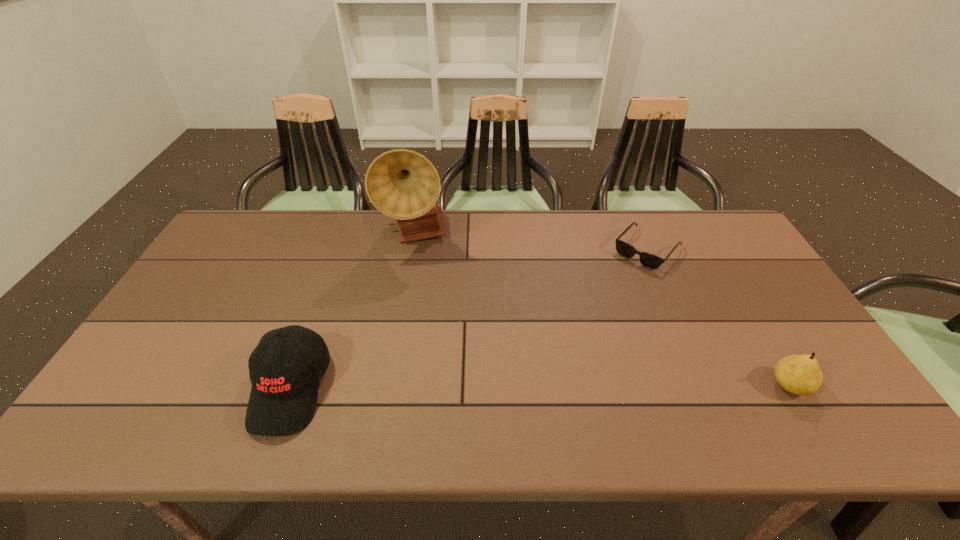
The image size is (960, 540). I want to click on vacant spot on the desktop that is between the leftmost object and the rightmost object and is positioned at the front lenses of the second object from right to left, so click(x=521, y=387).

You are a GUI agent. You are given a task and a screenshot of the screen. Output one action in this format:
    pyautogui.click(x=<x>, y=<y>)
    Task: Click on the vacant space on the desktop that is between the leftmost object and the rightmost object and is positioned on the horn of the second object from left to right
    This screenshot has width=960, height=540.
    Given the screenshot: What is the action you would take?
    pyautogui.click(x=570, y=387)